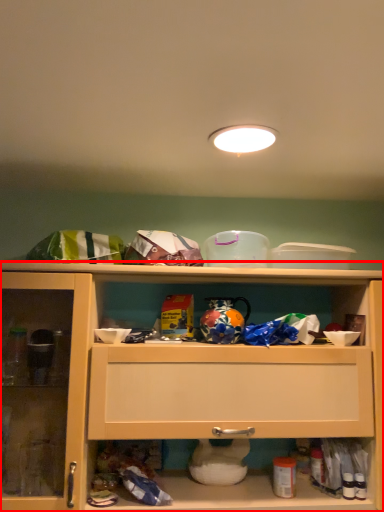
Question: Observing the image, what is the correct spatial positioning of cabinetry (annotated by the red box) in reference to lighting?

Choices:
 (A) right
 (B) left

Answer: (B)